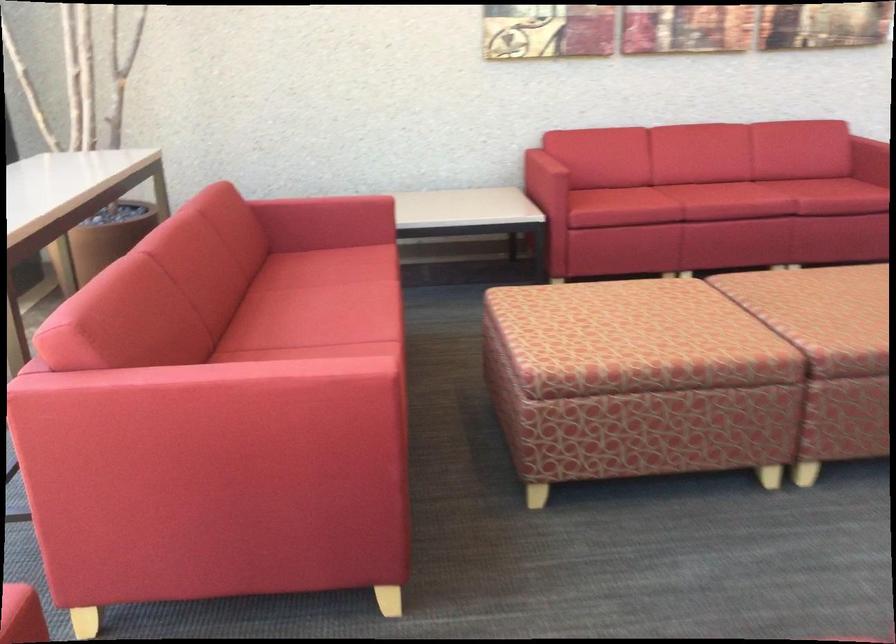
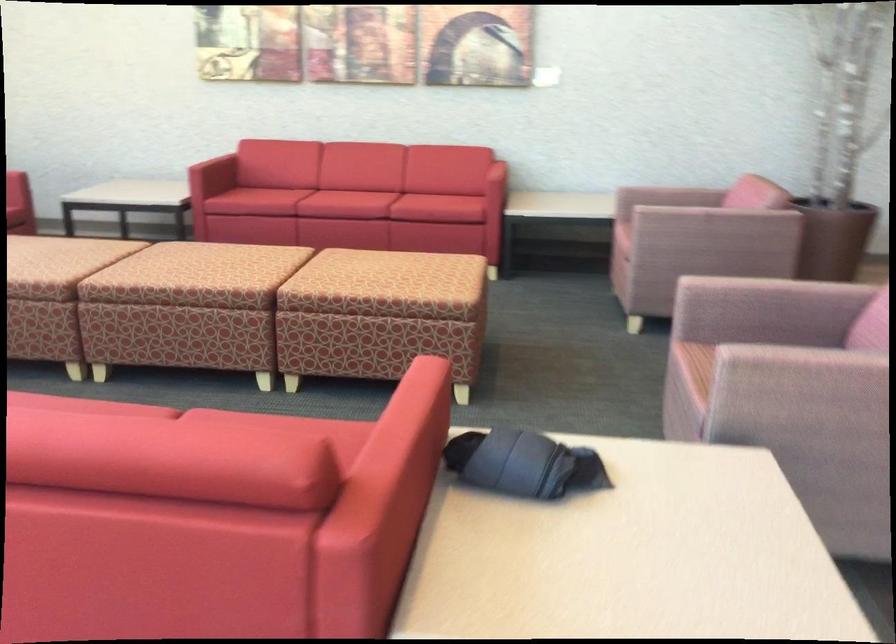
The point at (x=651, y=223) is marked in the first image. Where is the corresponding point in the second image?

(265, 200)